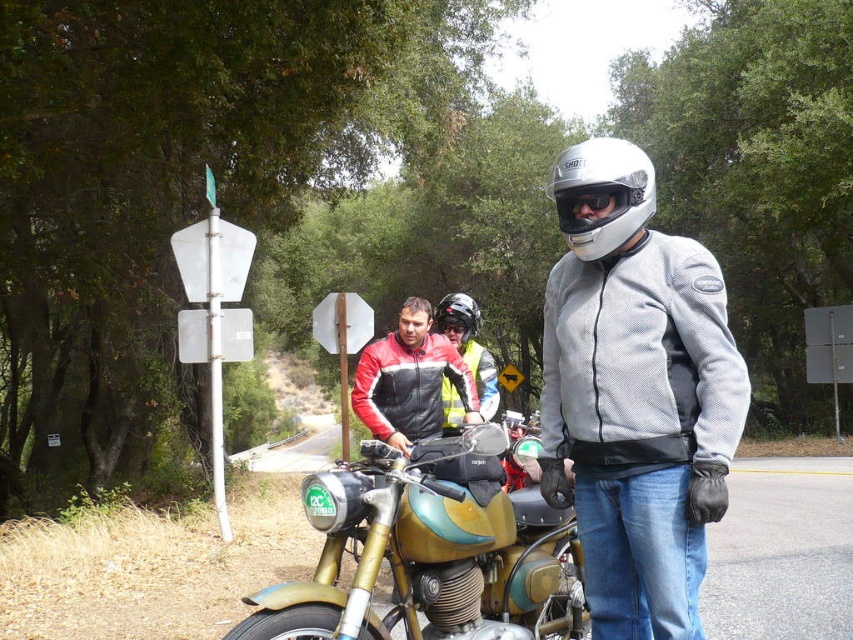
Is gold metallic motorcycle at center positioned in front of black matte goggles at center?

Yes, it is in front of black matte goggles at center.

Who is more distant from viewer, (514, 552) or (614, 188)?

The point (514, 552) is more distant.

At what (x,y) coordinates should I click in order to perform the action: click on gold metallic motorcycle at center. Please return your answer as a coordinate pair (x, y). Looking at the image, I should click on tap(430, 550).

Between silver metallic helmet at center and glossy black helmet at center, which one is positioned higher?

silver metallic helmet at center is above.

Is silver metallic helmet at center further to camera compared to glossy black helmet at center?

No, silver metallic helmet at center is closer to the viewer.

Describe the element at coordinates (601, 195) in the screenshot. I see `silver metallic helmet at center` at that location.

At what (x,y) coordinates should I click in order to perform the action: click on silver metallic helmet at center. Please return your answer as a coordinate pair (x, y). This screenshot has height=640, width=853. Looking at the image, I should click on (601, 195).

Who is higher up, black matte goggles at center or glossy black helmet at center?

Positioned higher is glossy black helmet at center.

Between point (601, 189) and point (467, 305), which one is positioned behind?

Point (467, 305)

Where is `black matte goggles at center`? This screenshot has height=640, width=853. black matte goggles at center is located at coordinates 590,205.